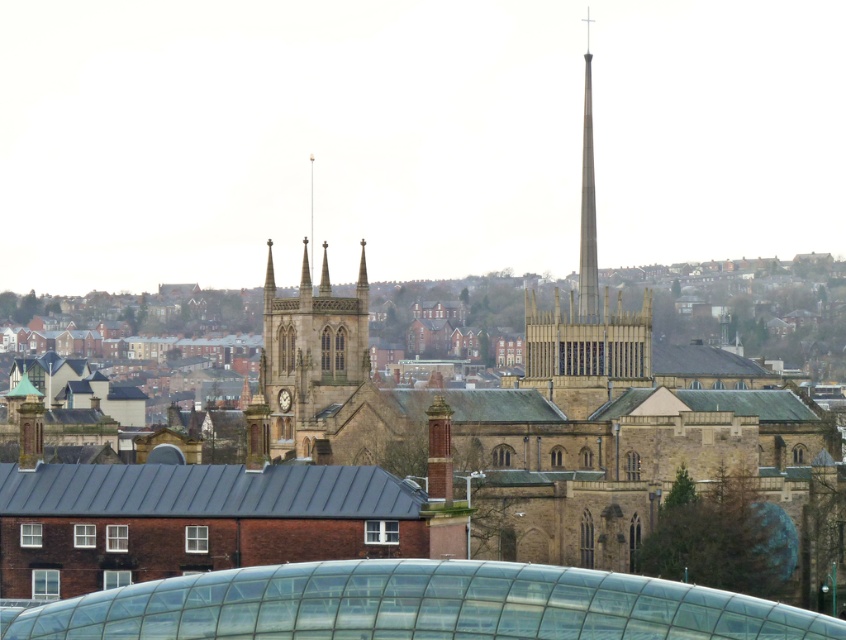
You are an architect analyzing the church spires. Which spire, the smooth stone spire at center or the smooth gray spire at center, is taller?

The smooth stone spire at center is taller than the smooth gray spire at center according to the description.

You are an architect planning to install a new weather vane on the tallest structure between the brown stone tower at center and the smooth gray spire at center. Which structure should you choose for the installation?

The smooth gray spire at center is larger in size compared to the brown stone tower at center, so the weather vane should be installed on the smooth gray spire at center.